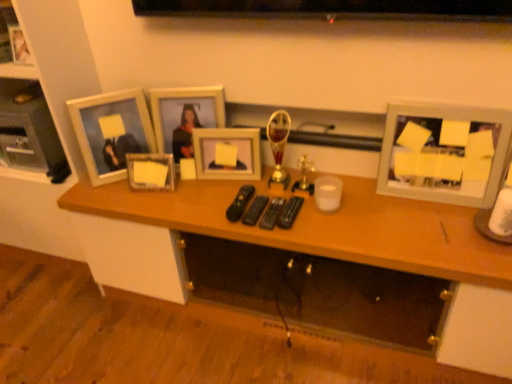
Locate an element on the screen. free point to the right of black plastic remote control at center, which is the third remote control in right-to-left order is located at coordinates (313, 213).